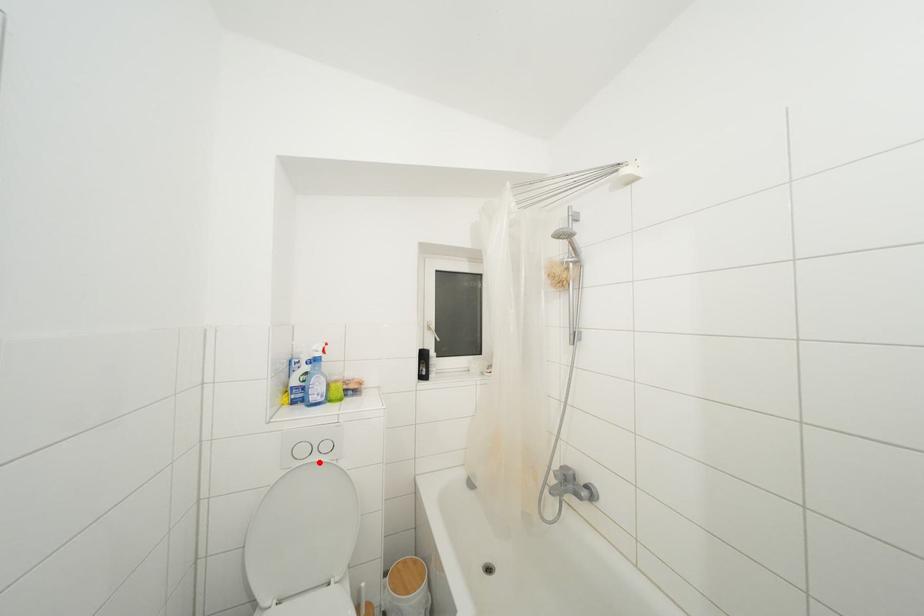
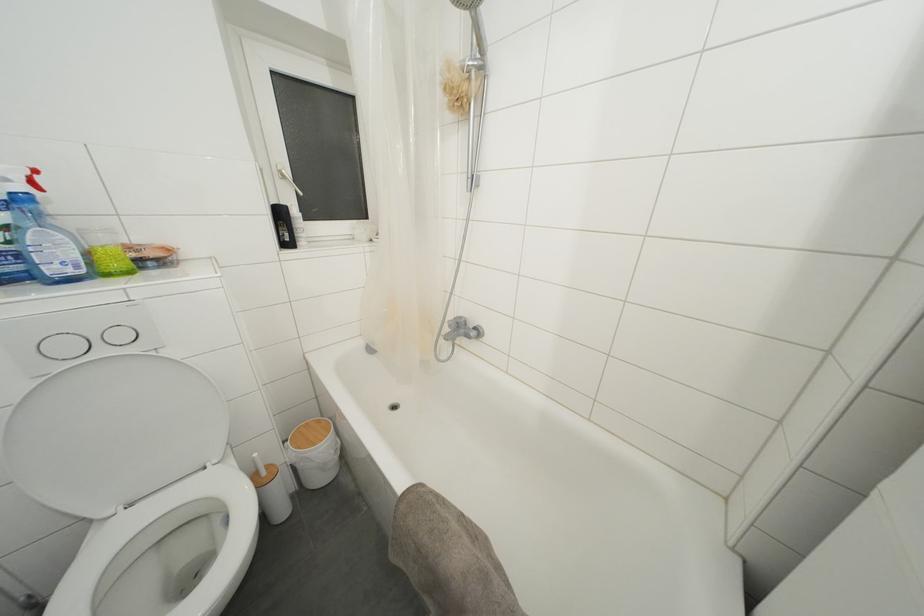
Where in the second image is the point corresponding to the highlighted location from the first image?

(106, 357)